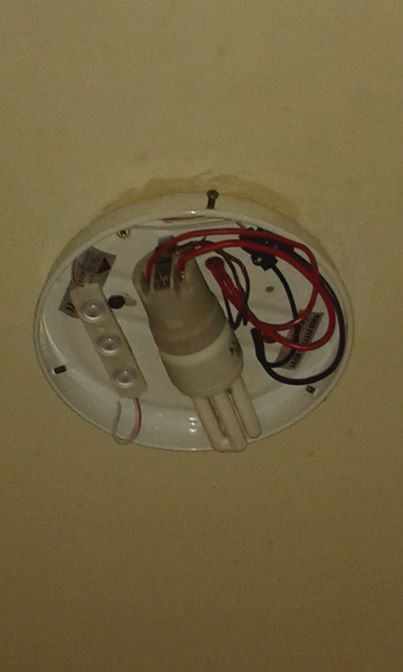
The image size is (403, 672). Identify the location of screws. (112, 304), (270, 341).